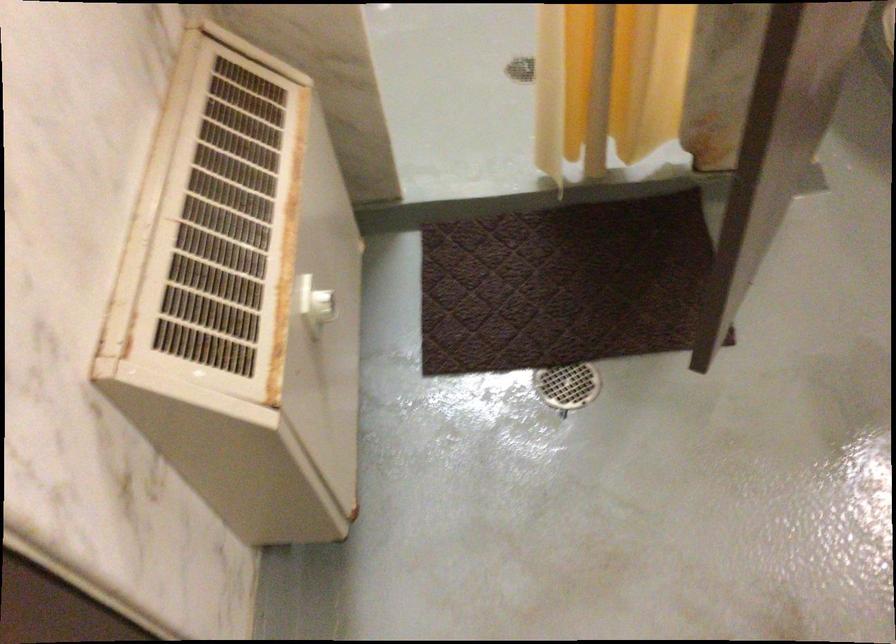
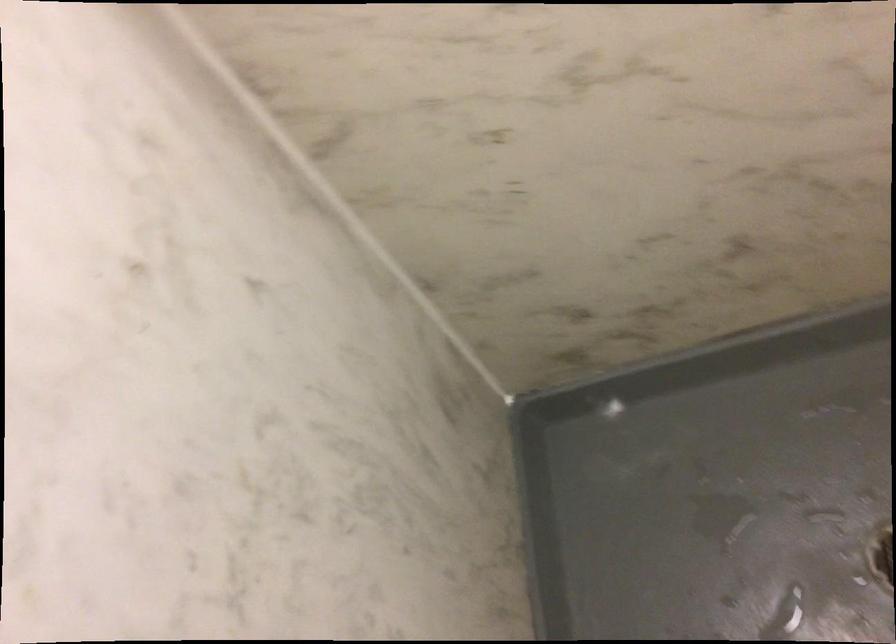
Question: In a continuous first-person perspective shot, in which direction is the camera moving?

Choices:
 (A) Left
 (B) Right
 (C) Forward
 (D) Backward

Answer: (C)